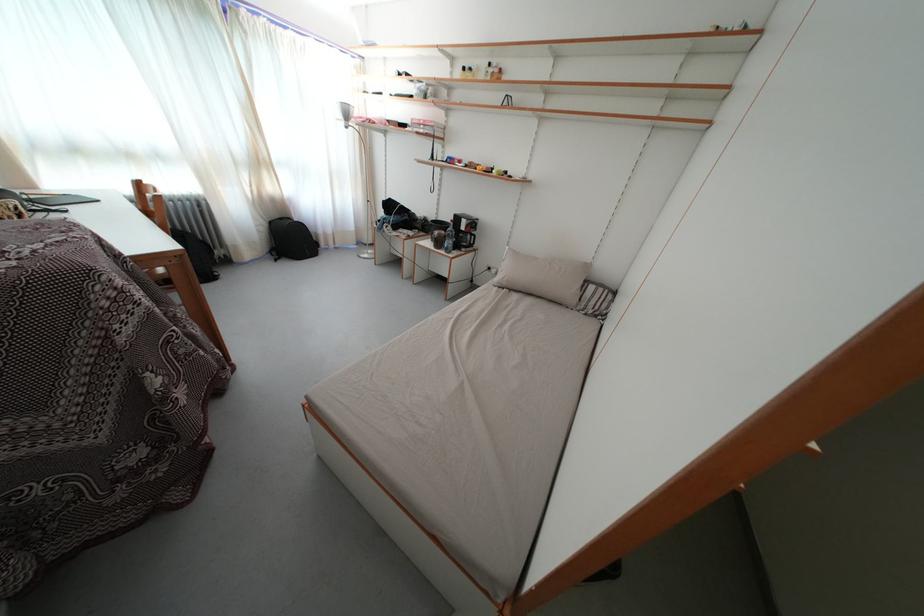
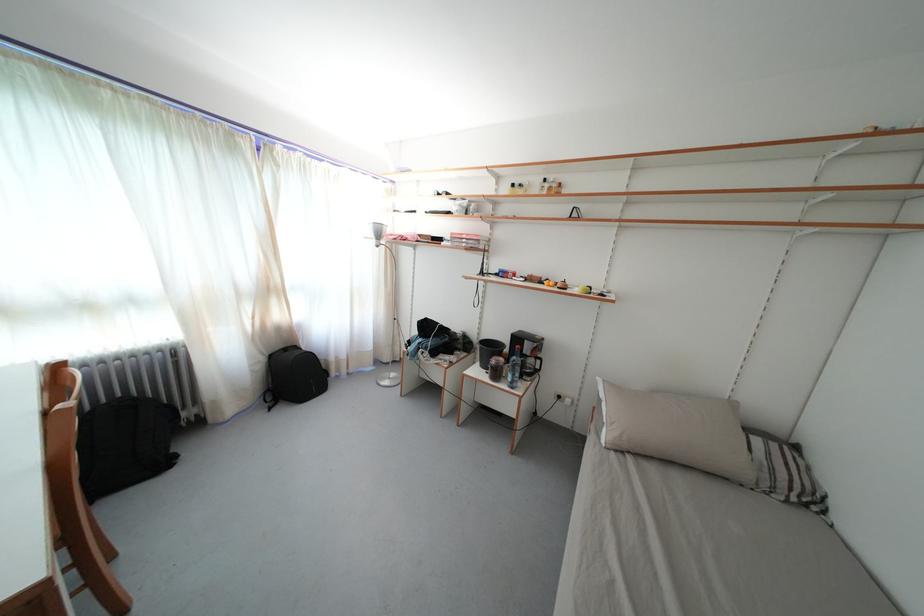
The point at (445,225) is marked in the first image. Where is the corresponding point in the second image?

(491, 341)